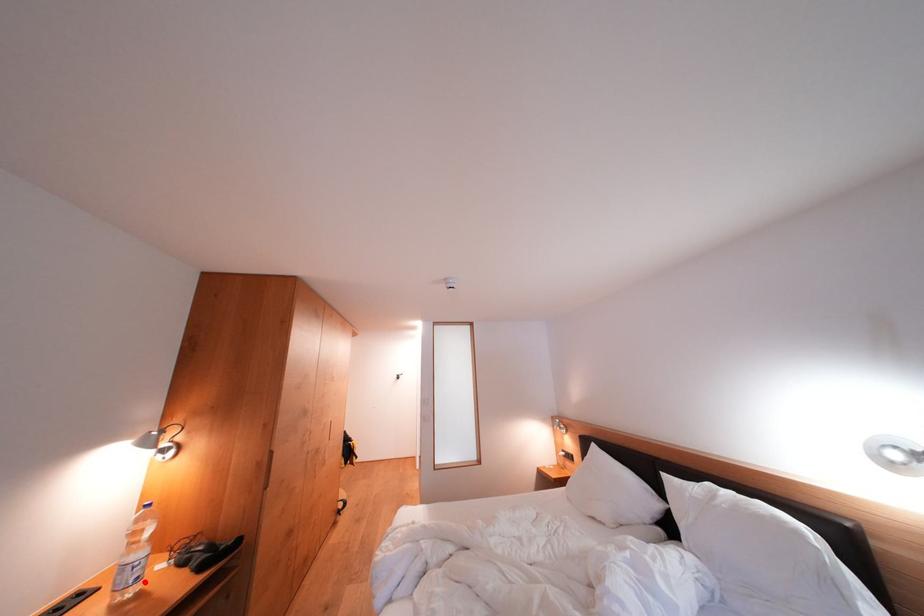
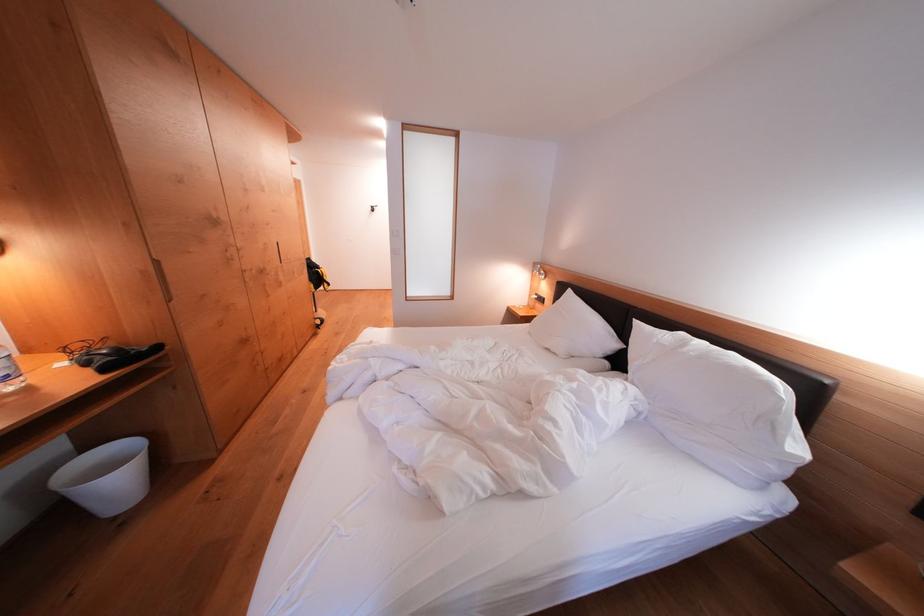
Where in the second image is the point corresponding to the highlighted location from the first image?

(14, 381)